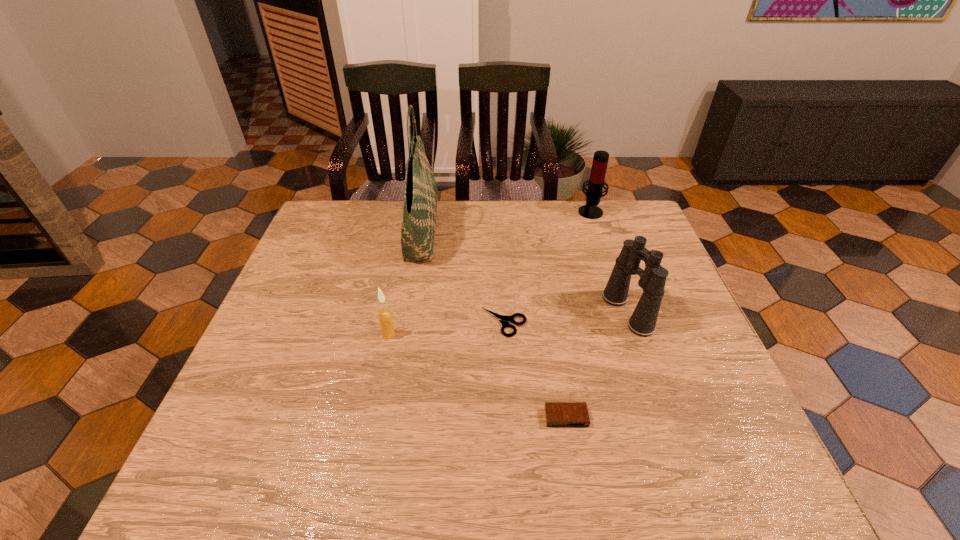
You are a GUI agent. You are given a task and a screenshot of the screen. Output one action in this format:
    pyautogui.click(x=<x>, y=<y>)
    Task: Click on the tallest object
    Image resolution: width=960 pixels, height=540 pixels.
    Given the screenshot: What is the action you would take?
    [x=420, y=192]

Where is `microphone`? microphone is located at coordinates (594, 193).

Identify the location of binoculars. (652, 280).

You are a GUI agent. You are given a task and a screenshot of the screen. Output one action in this format:
    pyautogui.click(x=<x>, y=<y>)
    Task: Click on the candle
    The width and height of the screenshot is (960, 540).
    Given the screenshot: What is the action you would take?
    pyautogui.click(x=385, y=317)

The height and width of the screenshot is (540, 960). Find the location of `alarm clock`. alarm clock is located at coordinates (558, 414).

Find the location of a particular element. the nearest object is located at coordinates (558, 414).

Find the location of a particular element. This screenshot has height=540, width=960. the shortest object is located at coordinates (504, 319).

You are a GUI agent. You are given a task and a screenshot of the screen. Output one action in this format:
    pyautogui.click(x=<x>, y=<y>)
    Task: Click on the third object from left to right
    The width and height of the screenshot is (960, 540).
    Given the screenshot: What is the action you would take?
    pyautogui.click(x=504, y=319)

In order to click on vacant space located on the front of the tallest object in this screenshot , I will do `click(412, 289)`.

At what (x,y) coordinates should I click in order to perform the action: click on vacant area situated 0.130m on the right of the microphone. Please return your answer as a coordinate pair (x, y). Looking at the image, I should click on (641, 211).